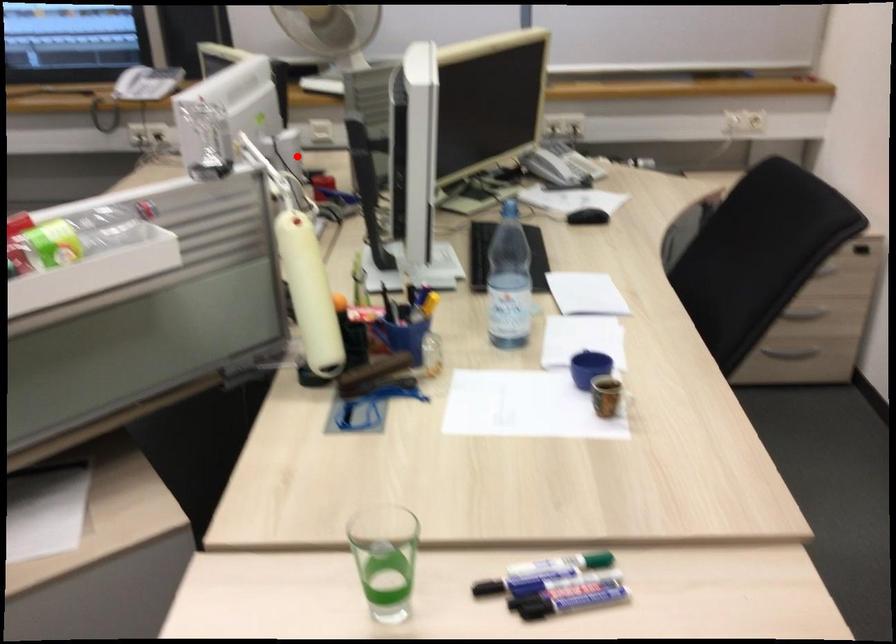
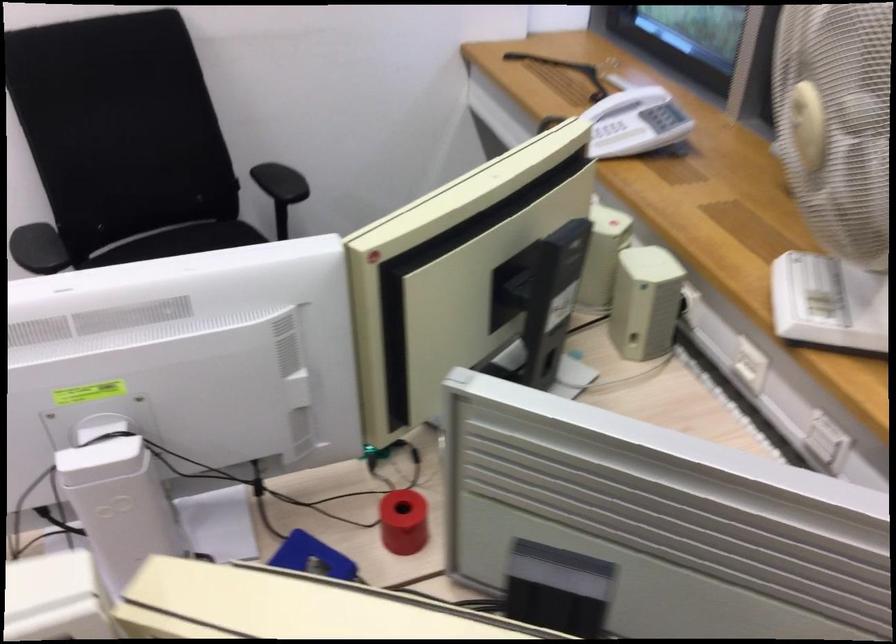
Question: I am providing you with two images of the same scene from different viewpoints. Given a red point in image1, look at the same physical point in image2. Is it:

Choices:
 (A) Closer to the viewpoint
 (B) Farther from the viewpoint

Answer: (A)